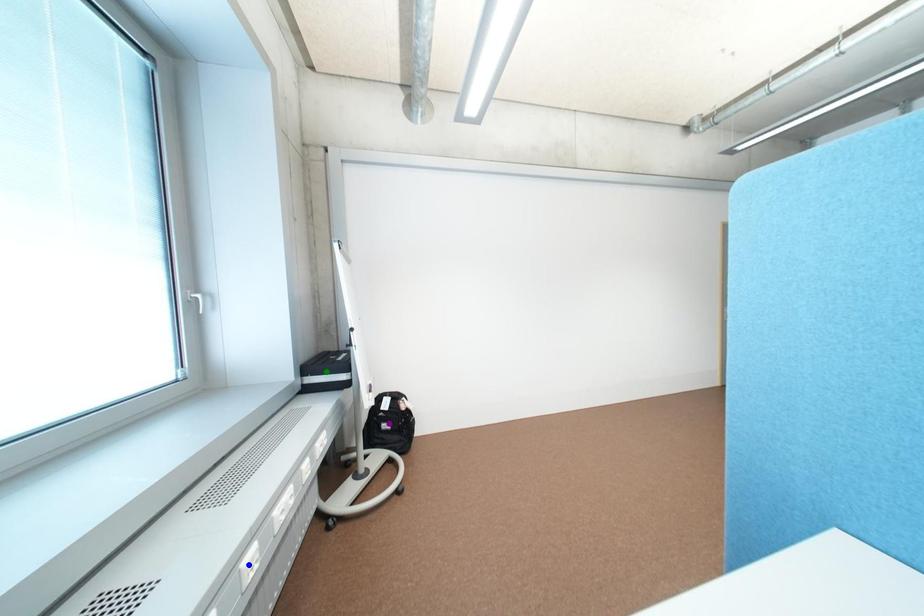
Order these from nearest to farthest:
- purple point
- green point
- blue point

1. purple point
2. green point
3. blue point